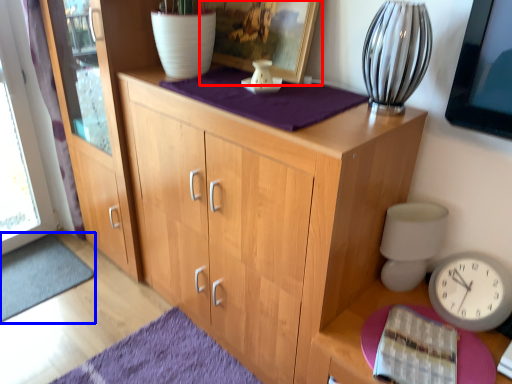
Question: Which point is further to the camera, picture frame (highlighted by a red box) or doormat (highlighted by a blue box)?

Choices:
 (A) picture frame
 (B) doormat

Answer: (B)